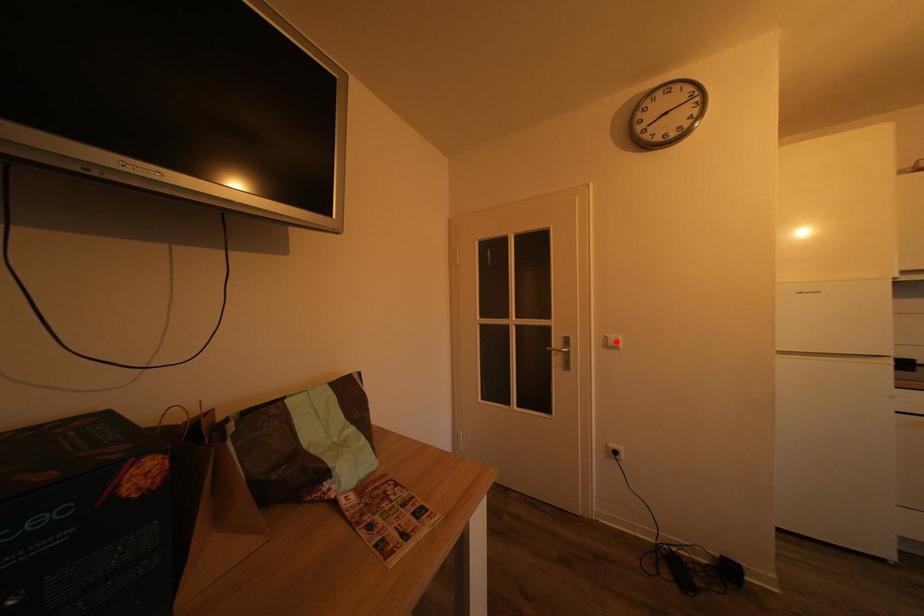
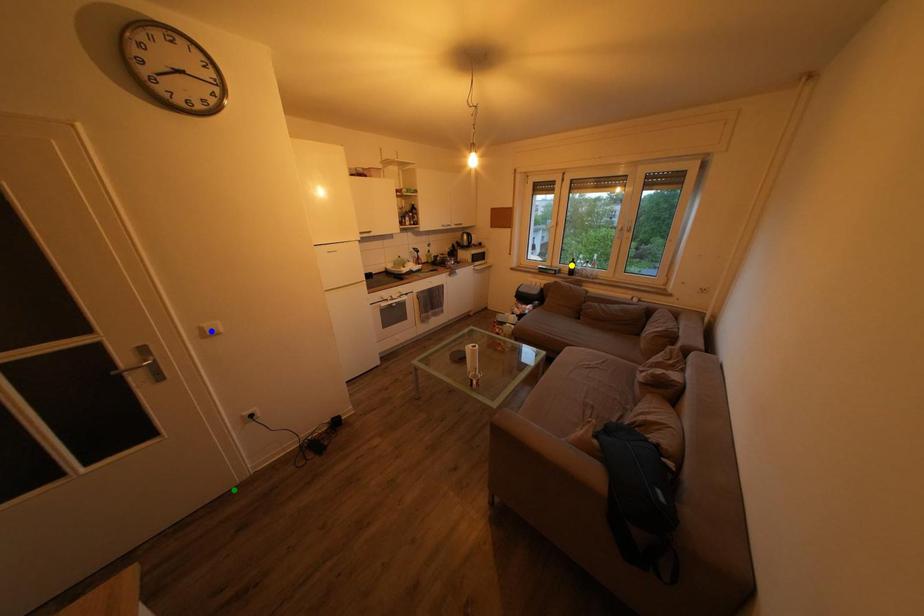
Question: I am providing you with two images of the same scene from different viewpoints. A red point is marked on the first image. You are given multiple points on the second image. Which point in image 2 is actually the same real-world point as the red point in image 1?

Choices:
 (A) yellow point
 (B) green point
 (C) blue point

Answer: (C)